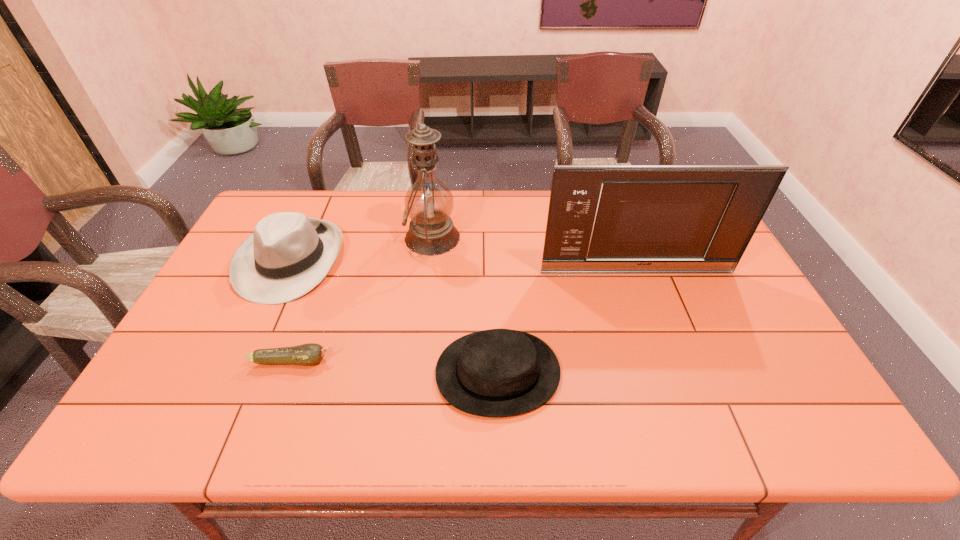
Where is `oil lamp`? oil lamp is located at coordinates pyautogui.click(x=429, y=203).

The height and width of the screenshot is (540, 960). Identify the location of microwave oven. (628, 219).

Locate an element on the screen. the third tallest object is located at coordinates (289, 254).

I want to click on the taller fedora, so click(x=289, y=254).

In order to click on the nearer fedora in this screenshot , I will do `click(499, 372)`.

The width and height of the screenshot is (960, 540). I want to click on the right fedora, so click(499, 372).

Where is `the shortest object`? Image resolution: width=960 pixels, height=540 pixels. the shortest object is located at coordinates (306, 354).

Where is `free location located on the right of the oil lamp`? free location located on the right of the oil lamp is located at coordinates (526, 238).

The height and width of the screenshot is (540, 960). Identify the location of free spot located 0.320m on the front panel of the microwave oven. (671, 366).

At what (x,y) coordinates should I click in order to perform the action: click on vacant point located on the front-facing side of the third shortest object. Please return your answer as a coordinate pair (x, y). The height and width of the screenshot is (540, 960). Looking at the image, I should click on point(249,350).